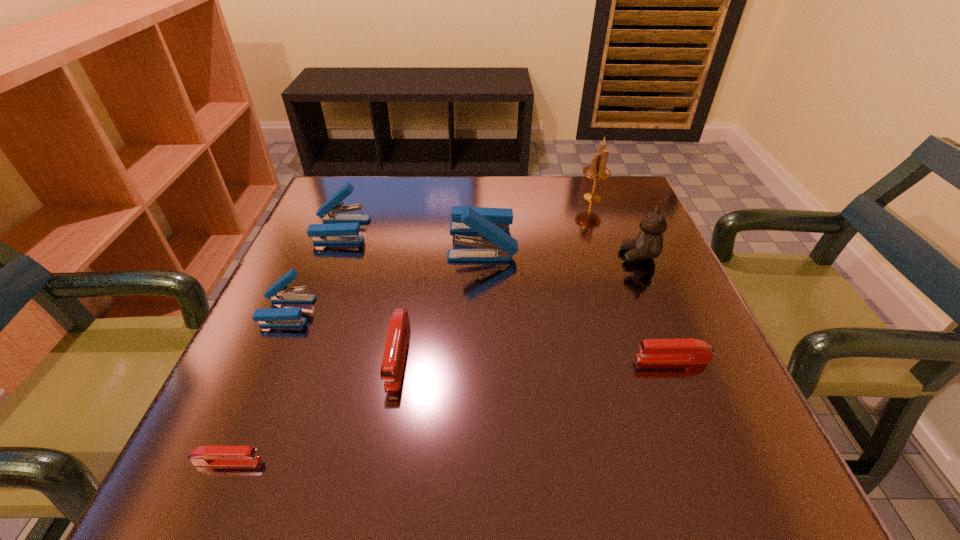
At what (x,y) coordinates should I click in order to perform the action: click on vacant region that satisfies the following two spatial constraints: 1. on the front-facing side of the fourth object from left to right; 2. on the front-facing side of the nearest object. Please return your answer as a coordinate pair (x, y). The width and height of the screenshot is (960, 540). Looking at the image, I should click on (379, 461).

You are a GUI agent. You are given a task and a screenshot of the screen. Output one action in this format:
    pyautogui.click(x=<x>, y=<y>)
    Task: Click on the free location that satisfies the following two spatial constraints: 1. on the face of the teddy bear; 2. on the front side of the smallest blue stapler
    The height and width of the screenshot is (540, 960).
    Given the screenshot: What is the action you would take?
    pyautogui.click(x=662, y=311)

Locate an element on the screen. This screenshot has width=960, height=540. blank space that satisfies the following two spatial constraints: 1. on the back side of the tallest object; 2. on the left side of the fourth tallest object is located at coordinates coord(354,198).